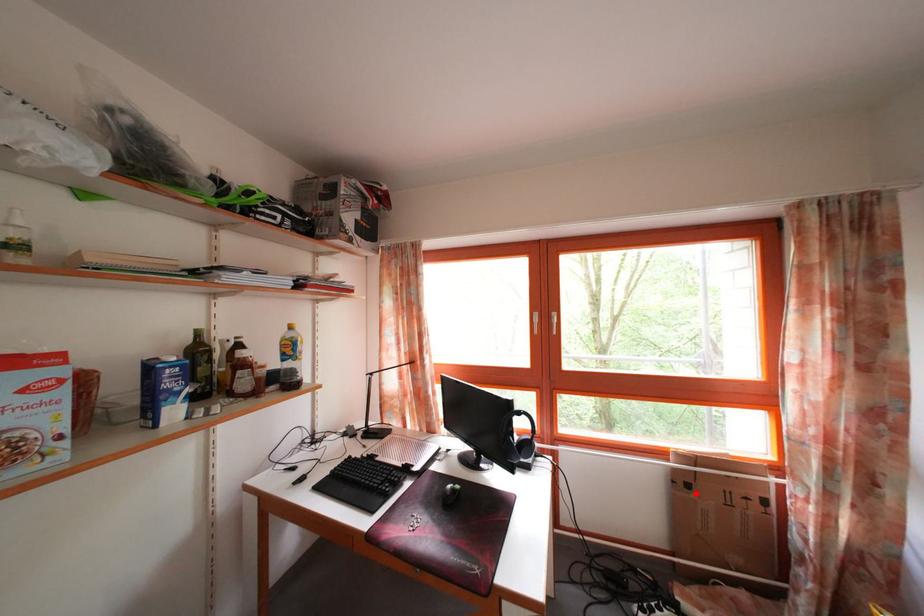
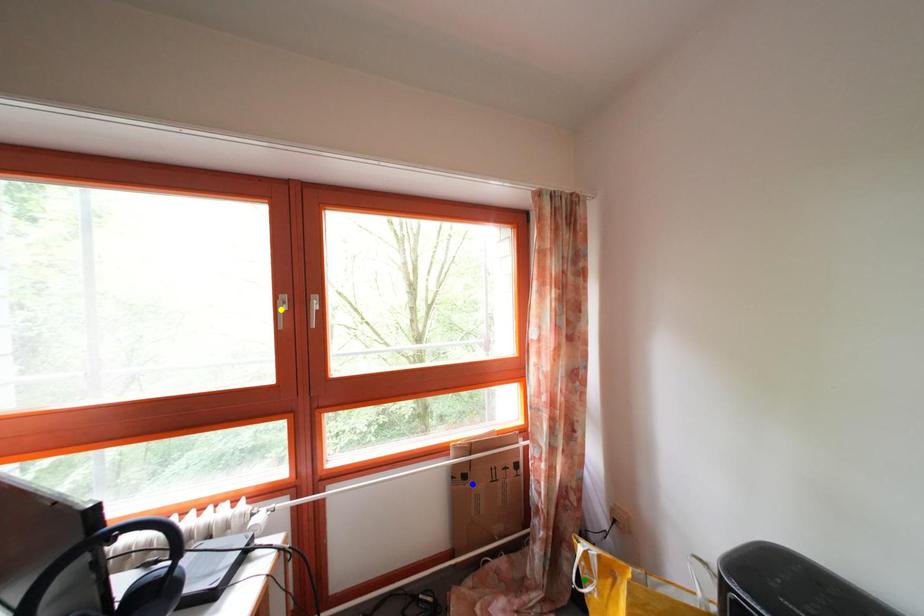
Question: I am providing you with two images of the same scene from different viewpoints. A red point is marked on the first image. You are given multiple points on the second image. In image 2, which mark is for the same physical point as the one in image 1?

Choices:
 (A) green point
 (B) blue point
 (C) yellow point

Answer: (B)